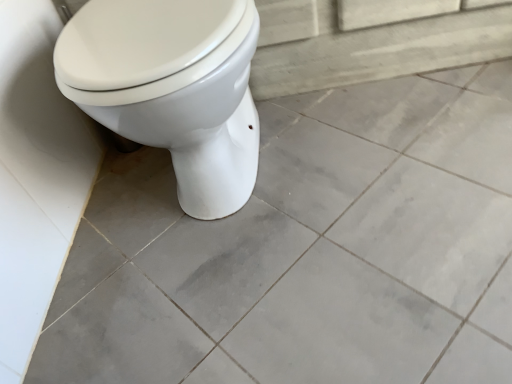
The image size is (512, 384). Find the location of `free space in front of white glossy toilet at center`. free space in front of white glossy toilet at center is located at coordinates (270, 300).